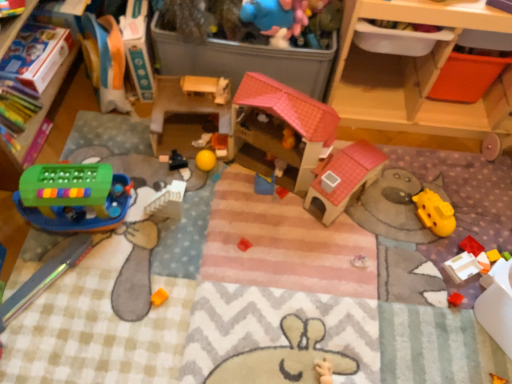
Image resolution: width=512 pixels, height=384 pixels. Identify the location of vacant space that is in between metallic blue car at center, which appears as the 8th toy when viewed from the right, and yellow plastic spoon at center, marked as the 3th toy in a right-to-left arrangement. (226, 178).